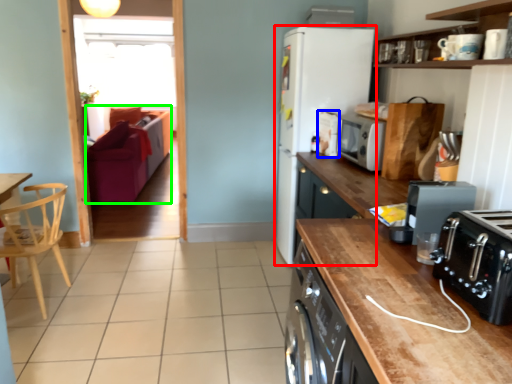
Question: Which object is positioned farthest from refrigerator (highlighted by a red box)? Select from appliance (highlighted by a blue box) and armchair (highlighted by a green box).

Choices:
 (A) appliance
 (B) armchair

Answer: (B)